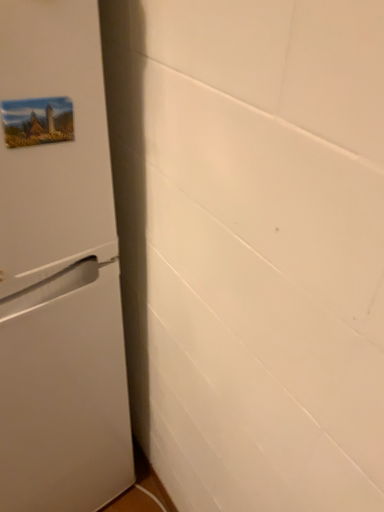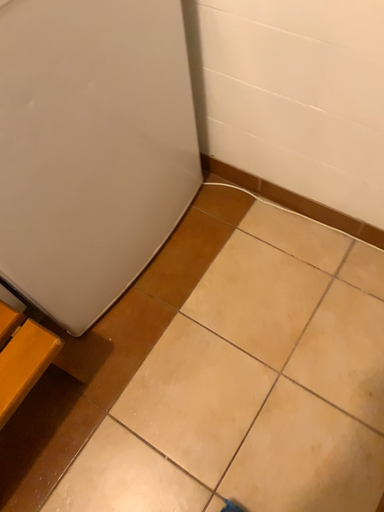
Question: How did the camera likely rotate when shooting the video?

Choices:
 (A) rotated upward
 (B) rotated downward

Answer: (B)